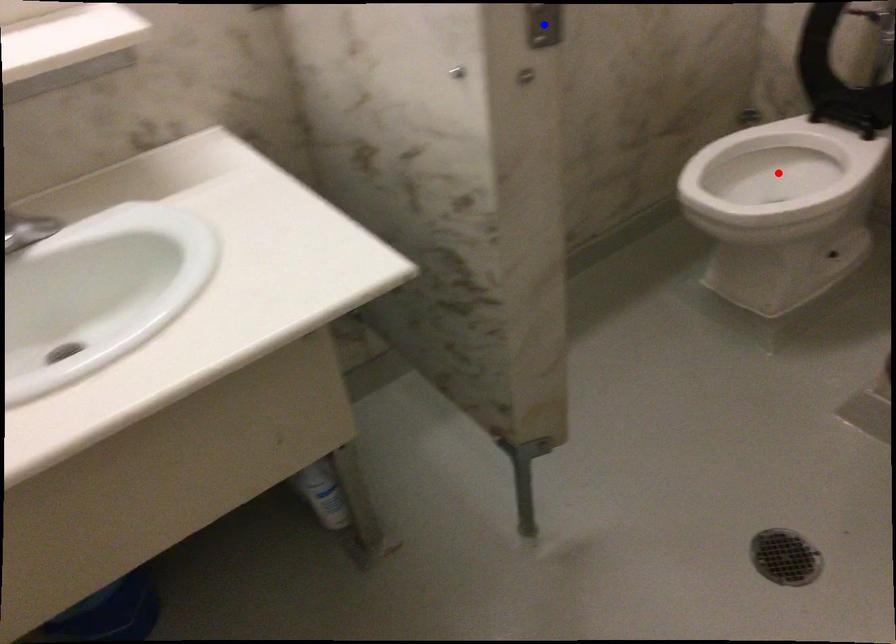
Question: Two points are marked on the image. Which point is closer to the camera?

Choices:
 (A) Blue point is closer.
 (B) Red point is closer.

Answer: (A)